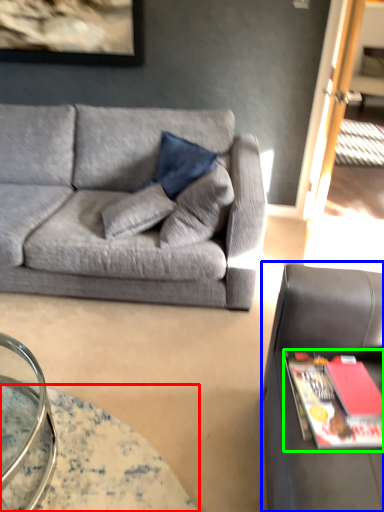
Question: Considering the real-world distances, which object is farthest from table (highlighted by a red box)? studio couch (highlighted by a blue box) or magazine (highlighted by a green box)?

Choices:
 (A) studio couch
 (B) magazine

Answer: (B)